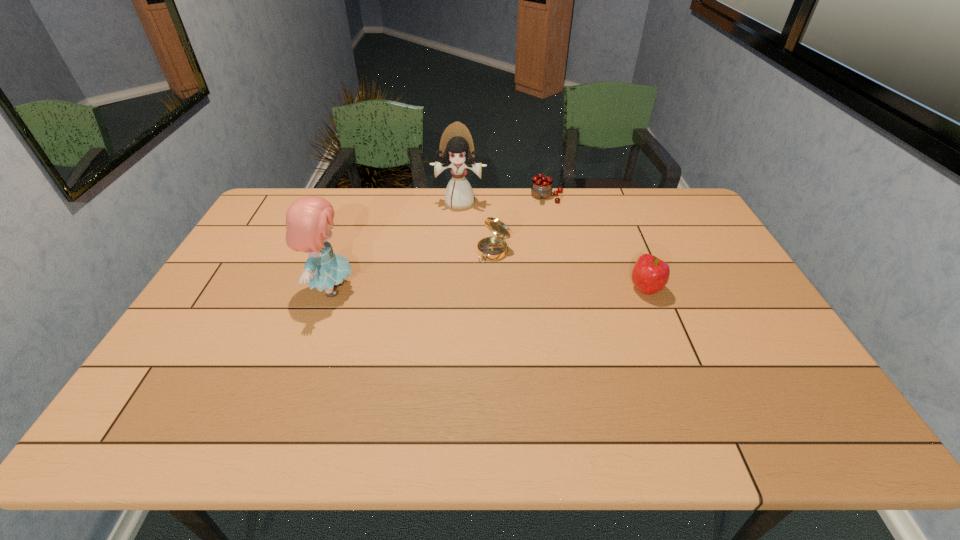
Find the location of `free space located with the dial facing the compass`. free space located with the dial facing the compass is located at coordinates (462, 282).

I want to click on blank area located 0.210m at the front face of the farther doll, so click(451, 248).

Where is `free space located at the front face of the farther doll`? Image resolution: width=960 pixels, height=540 pixels. free space located at the front face of the farther doll is located at coordinates (448, 266).

In order to click on vacant space located at the front face of the farther doll in this screenshot , I will do `click(453, 240)`.

This screenshot has width=960, height=540. Find the location of `vacant space located on the handle side of the pot filled with cherries`. vacant space located on the handle side of the pot filled with cherries is located at coordinates (539, 234).

Where is `vacant space located 0.350m on the handle side of the pot filled with cherries`? The image size is (960, 540). vacant space located 0.350m on the handle side of the pot filled with cherries is located at coordinates (533, 267).

Where is `vacant space positioned on the handle side of the pot filled with cherries`? This screenshot has height=540, width=960. vacant space positioned on the handle side of the pot filled with cherries is located at coordinates (532, 271).

Find the location of `doll that is positioned at the far edge`. doll that is positioned at the far edge is located at coordinates (456, 151).

I want to click on pot filled with cherries situated at the far edge, so click(541, 188).

The image size is (960, 540). Find the location of `free region at the far edge of the desktop`. free region at the far edge of the desktop is located at coordinates (437, 200).